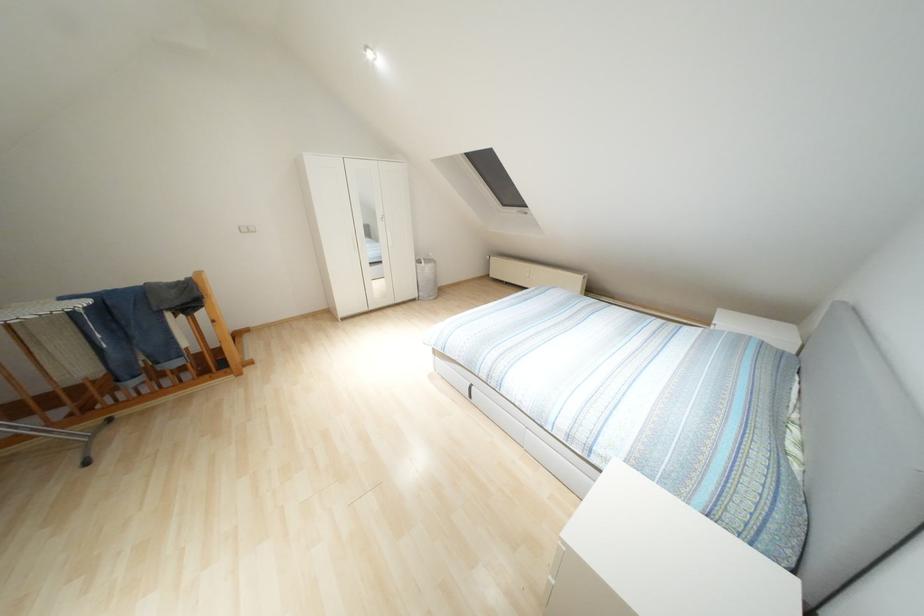
Find where to pull the skylight window handle. Please return your answer as a coordinate pair (x, y).

(523, 211)